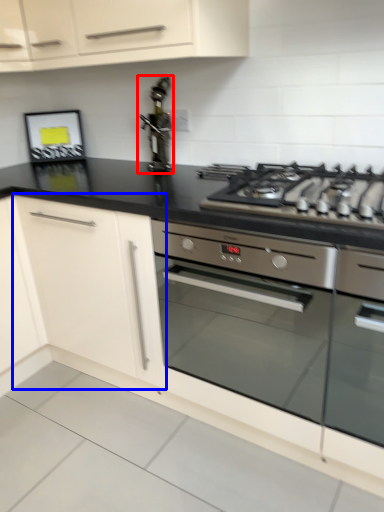
Question: Which point is further to the camera, stainless steel (highlighted by a red box) or cabinetry (highlighted by a blue box)?

Choices:
 (A) stainless steel
 (B) cabinetry

Answer: (A)